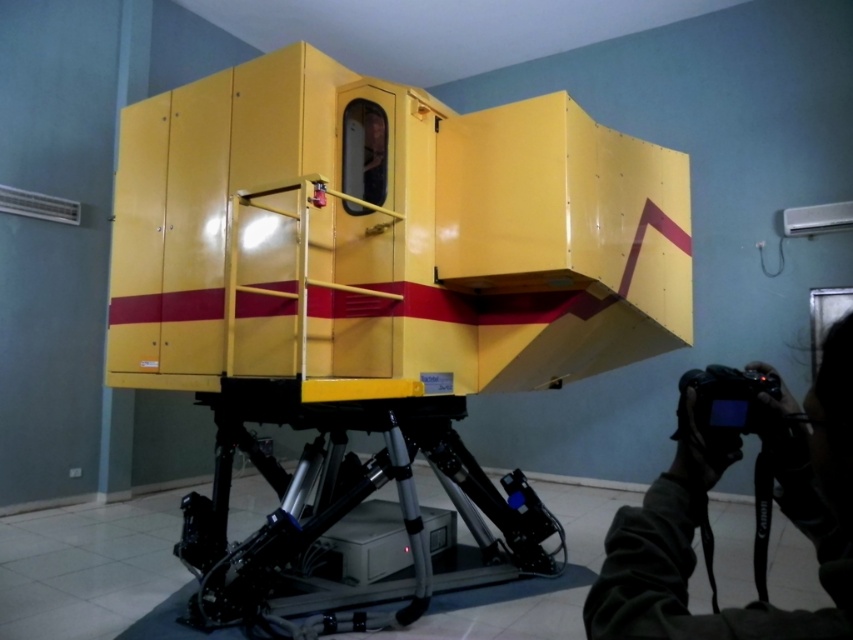
Who is more distant from viewer, [331,438] or [782,481]?

The point [331,438] is more distant.

Which is in front, point (228, 403) or point (776, 477)?

Positioned in front is point (776, 477).

Image resolution: width=853 pixels, height=640 pixels. I want to click on metallic tripod at lower center, so click(347, 515).

Is point (846, 476) positioned behind point (718, 406)?

No, (846, 476) is closer to viewer.

Is point (843, 513) positioned behind point (683, 433)?

No, (843, 513) is in front of (683, 433).

The width and height of the screenshot is (853, 640). What are the coordinates of `black fabric camera at lower right` in the screenshot? It's located at 704,515.

Which is below, metallic tripod at lower center or black plastic video camera at lower right?

Positioned lower is metallic tripod at lower center.

Can you confirm if metallic tripod at lower center is taller than black plastic video camera at lower right?

Indeed, metallic tripod at lower center has a greater height compared to black plastic video camera at lower right.

Describe the element at coordinates (347, 515) in the screenshot. I see `metallic tripod at lower center` at that location.

Identify the location of metallic tripod at lower center. The image size is (853, 640). (347, 515).